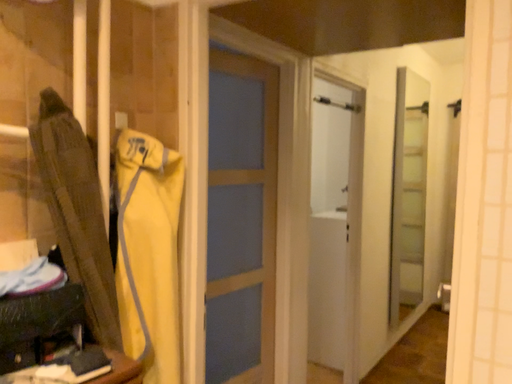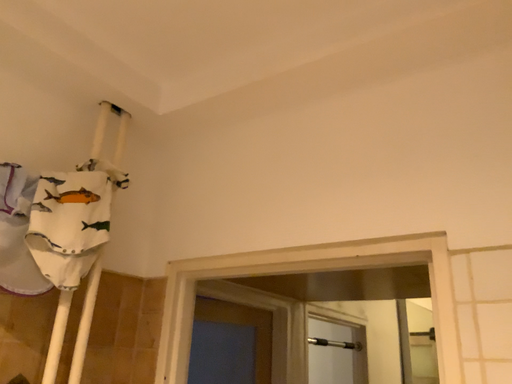
Question: Which way did the camera rotate in the video?

Choices:
 (A) rotated upward
 (B) rotated downward

Answer: (A)